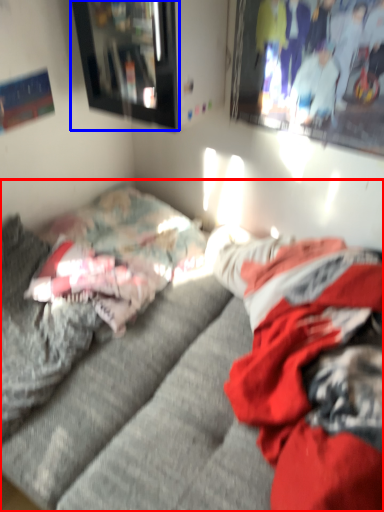
Question: Which of the following is the closest to the observer, studio couch (highlighted by a red box) or picture frame (highlighted by a blue box)?

Choices:
 (A) studio couch
 (B) picture frame

Answer: (A)